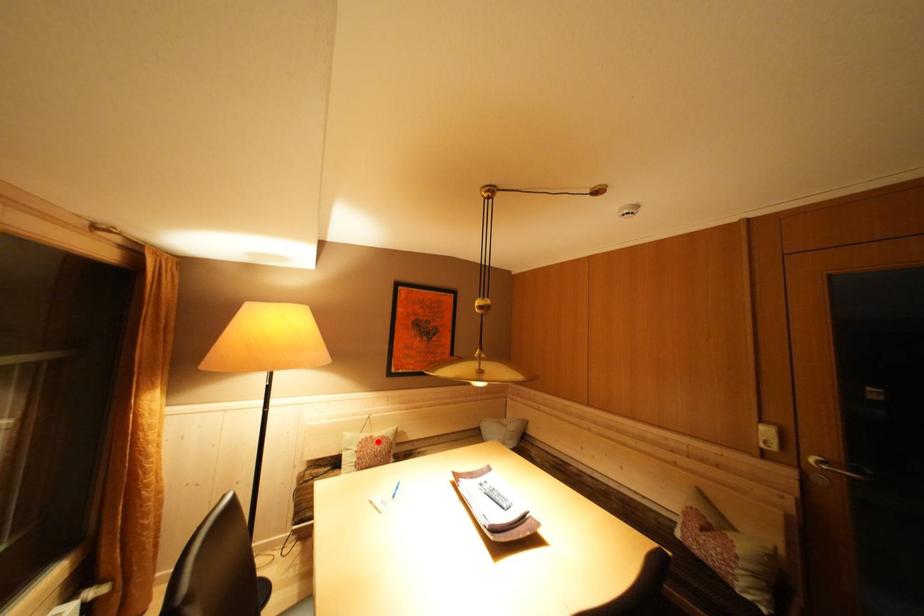
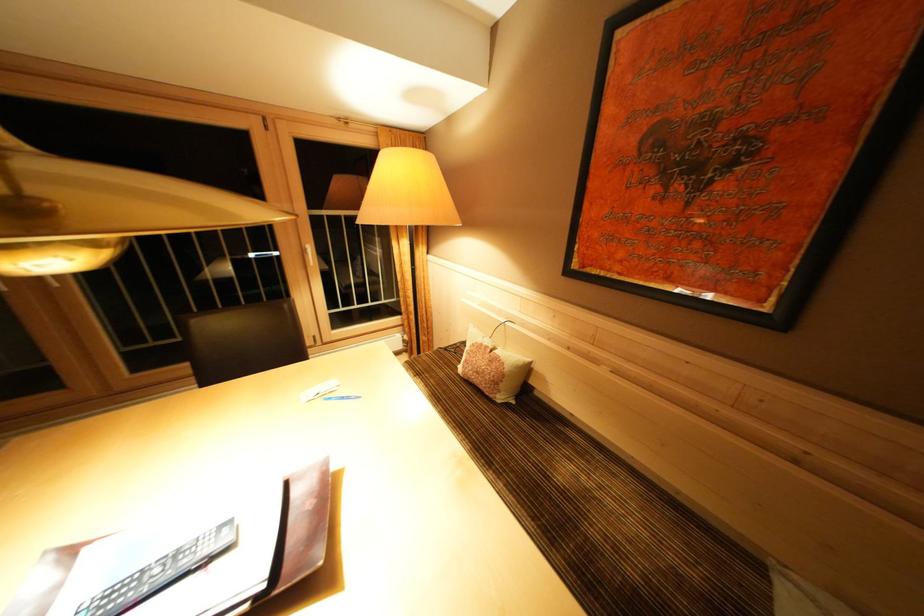
Find the pixel in the second image that matches the highlighted location in the first image.

(493, 352)